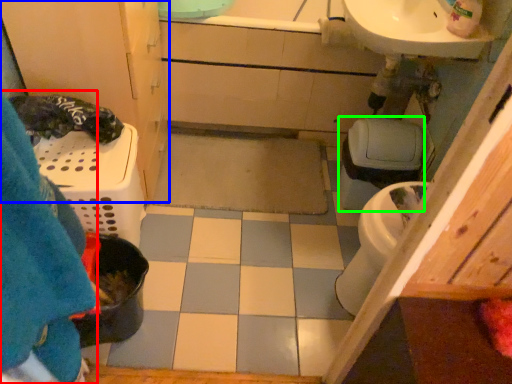
Question: Considering the real-world distances, which object is closest to blanket (highlighted by a red box)? bathroom cabinet (highlighted by a blue box) or toilet bowl (highlighted by a green box).

Choices:
 (A) bathroom cabinet
 (B) toilet bowl

Answer: (A)